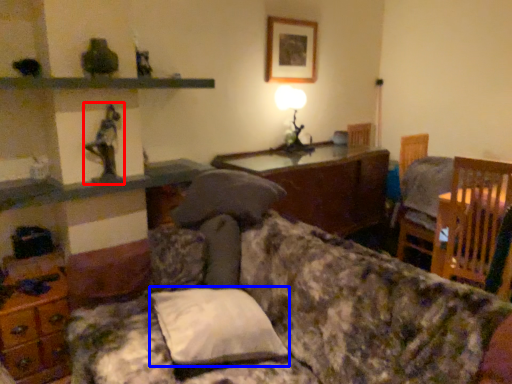
Question: Which object is further to the camera taking this photo, toy (highlighted by a red box) or pillow (highlighted by a blue box)?

Choices:
 (A) toy
 (B) pillow

Answer: (A)